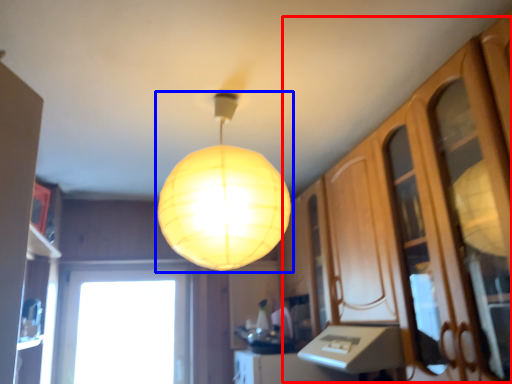
Question: Among these objects, which one is farthest to the camera, dresser (highlighted by a red box) or lamp (highlighted by a blue box)?

Choices:
 (A) dresser
 (B) lamp

Answer: (B)